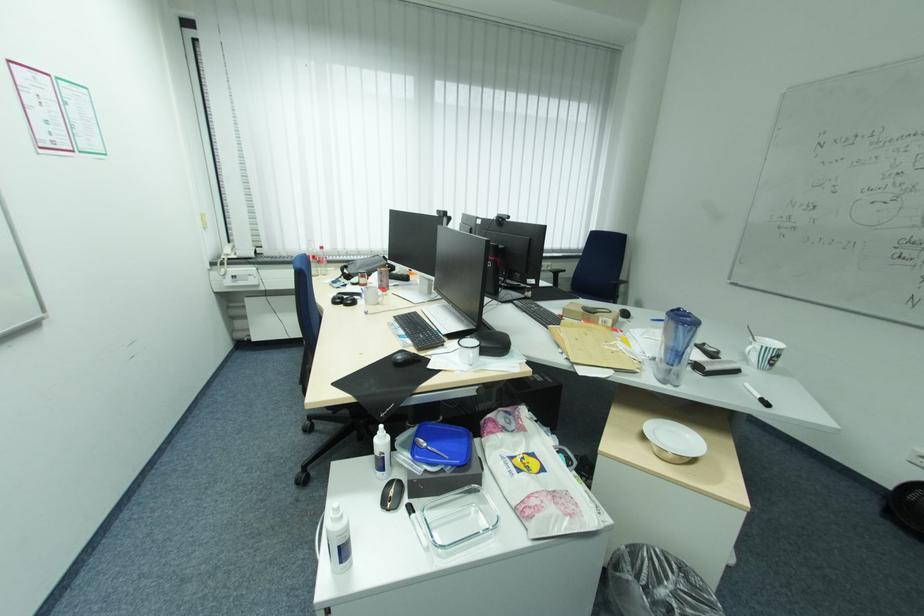
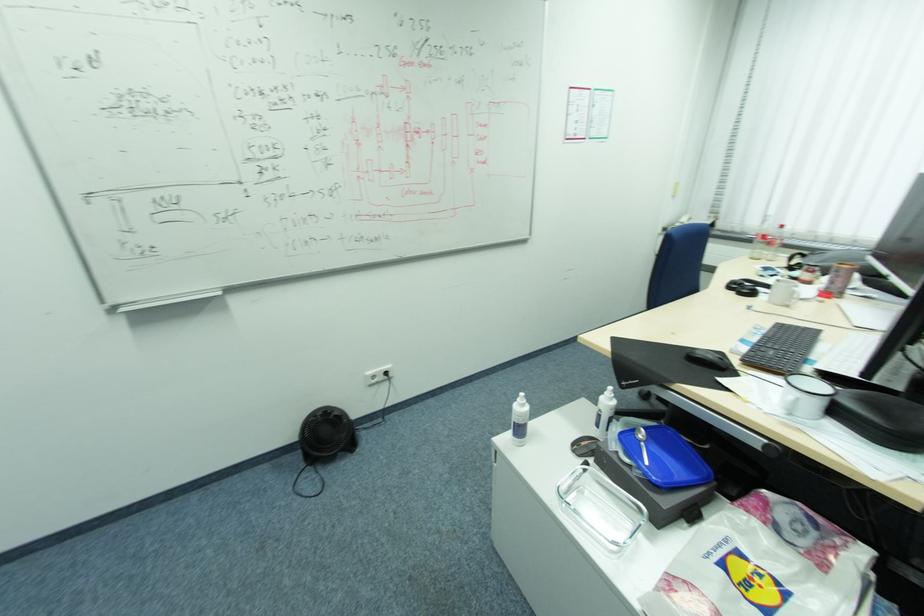
Locate, in the second image, the point that corresponds to the point at 350,549 in the first image.

(526, 430)